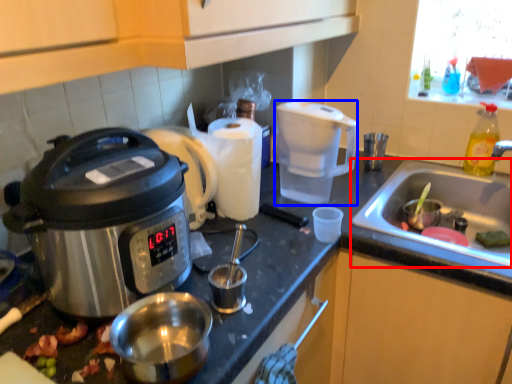
Question: Which object appears closest to the camera in this image, sink (highlighted by a red box) or coffee maker (highlighted by a blue box)?

Choices:
 (A) sink
 (B) coffee maker

Answer: (A)